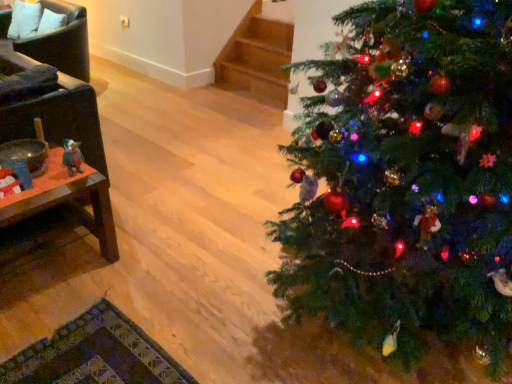
I want to click on vacant space that's between green matte christmas tree at right and woodenmaterial/texturetable at left, so click(x=173, y=260).